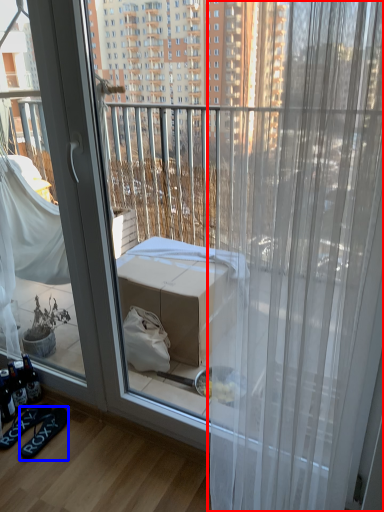
Question: Which of the following is the closest to the observer, curtain (highlighted by a red box) or footwear (highlighted by a blue box)?

Choices:
 (A) curtain
 (B) footwear

Answer: (A)